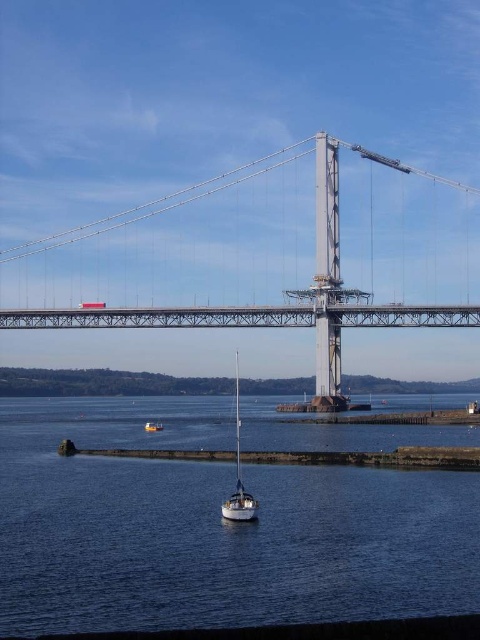
You are a drone operator trying to capture an aerial view of the metallic gray suspension bridge at center. Your drone is currently at the coordinates of the sailboat. What direction should you move the drone to align it with the bridge?

The metallic gray suspension bridge at center is located at coordinates point (253, 305). Since the sailboat is in the foreground, moving the drone towards the center coordinates would align it with the bridge.

You are standing on the deck of the sailboat anchored near the breakwater. You see the blue water at center and the metallic gray suspension bridge at center. Which object is closer to your current position?

The blue water at center is closer to your current position because it is located below the metallic gray suspension bridge at center, meaning the bridge is elevated above the water.